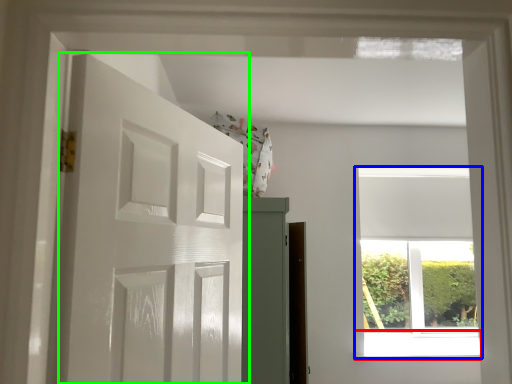
Question: Estimate the real-world distances between objects in this image. Which object is farther from window sill (highlighted by a red box), window (highlighted by a blue box) or door (highlighted by a green box)?

Choices:
 (A) window
 (B) door

Answer: (B)